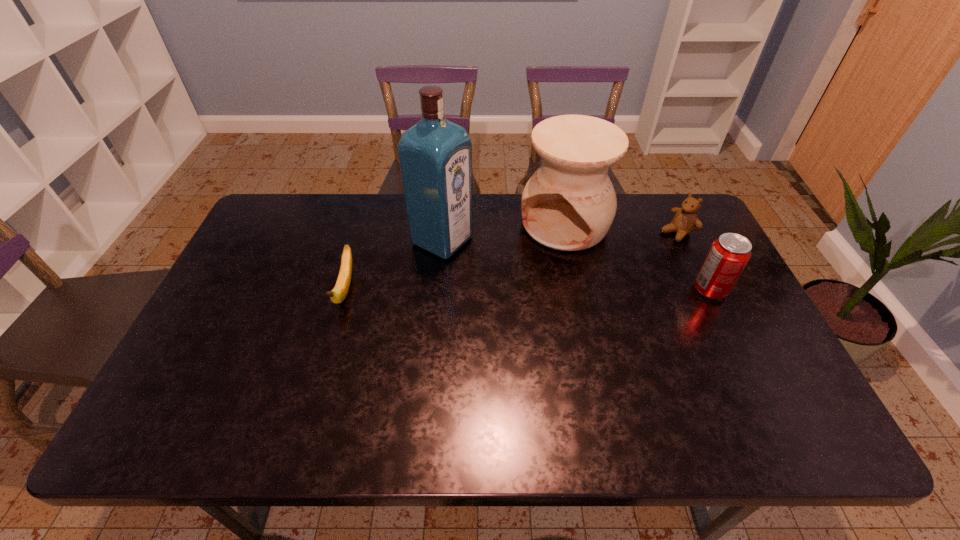
In order to click on free space on the desktop that is between the shortest object and the third shortest object and is positioned at the open side of the third object from left to right in this screenshot , I will do `click(516, 291)`.

Identify the location of free space on the desktop that is between the shortest object and the third shortest object and is positioned on the flat label side of the liquor. The width and height of the screenshot is (960, 540). (547, 291).

Identify the location of vacant spot on the desktop that is between the banana and the soda and is positioned on the front-facing side of the teddy bear. This screenshot has width=960, height=540. (578, 290).